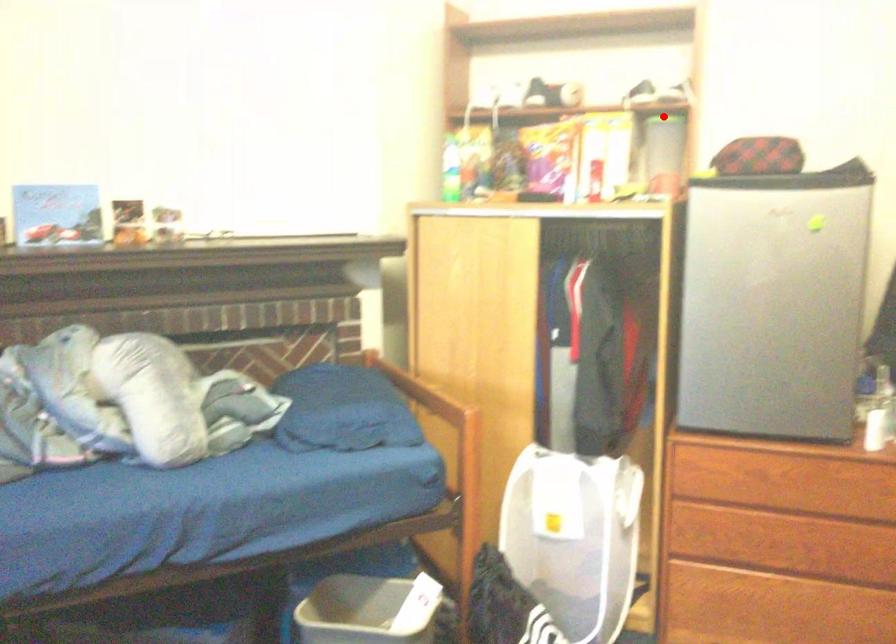
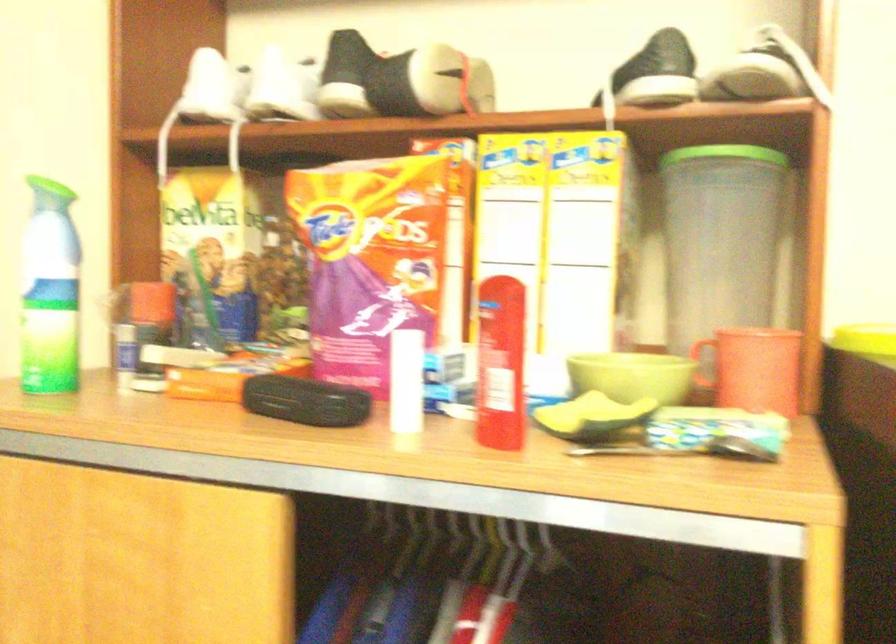
Question: I am providing you with two images of the same scene from different viewpoints. In image1, a red point is highlighted. Considering the same 3D point in image2, which of the following is correct?

Choices:
 (A) It is closer
 (B) It is farther

Answer: (A)